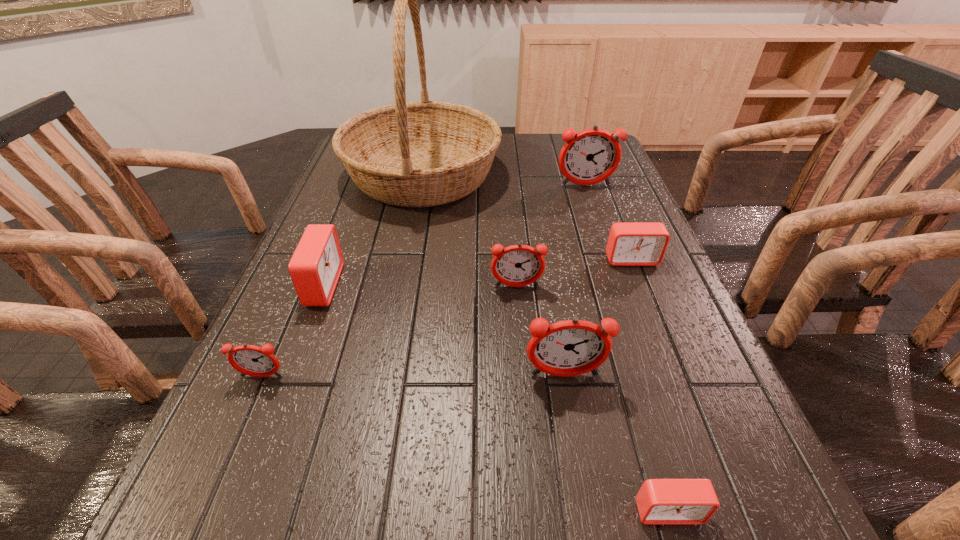
Locate an element on the screen. the nearest alarm clock is located at coordinates (659, 501).

This screenshot has height=540, width=960. Find the location of `free space located on the front of the basket`. free space located on the front of the basket is located at coordinates (402, 279).

The height and width of the screenshot is (540, 960). I want to click on free space located 0.310m on the front-facing side of the biggest reddish-pink alarm clock, so click(x=611, y=258).

Find the location of a particular element. Image resolution: width=960 pixels, height=540 pixels. vacant area situated 0.140m on the front-facing side of the sixth shortest alarm clock is located at coordinates (579, 460).

What are the coordinates of `blank space located on the front-facing side of the third biggest reddish-pink alarm clock` in the screenshot? It's located at (523, 357).

Identify the location of free location located 0.130m on the front-facing side of the biggest red alarm clock. This screenshot has height=540, width=960. (397, 286).

Identify the location of free point located on the front-facing side of the second biggest red alarm clock. Image resolution: width=960 pixels, height=540 pixels. (652, 312).

Locate an element on the screen. vacant space located 0.090m on the front-facing side of the leftmost reddish-pink alarm clock is located at coordinates (239, 428).

You are a GUI agent. You are given a task and a screenshot of the screen. Output one action in this format:
    pyautogui.click(x=<x>, y=<y>)
    Task: Click on the object present at the far edge
    
    Given the screenshot: What is the action you would take?
    pyautogui.click(x=424, y=153)

Find the location of a particular element. object present at the near edge is located at coordinates (659, 501).